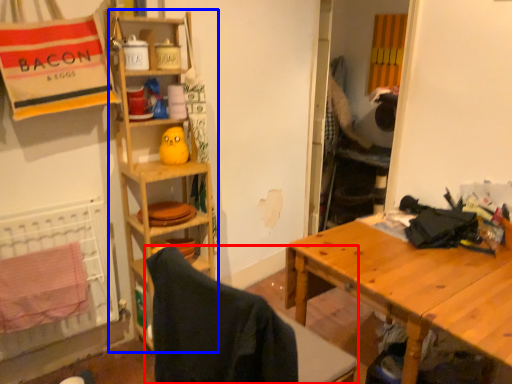
Question: Which of the following is the closest to the observer, folding chair (highlighted by a red box) or shelf (highlighted by a blue box)?

Choices:
 (A) folding chair
 (B) shelf

Answer: (A)